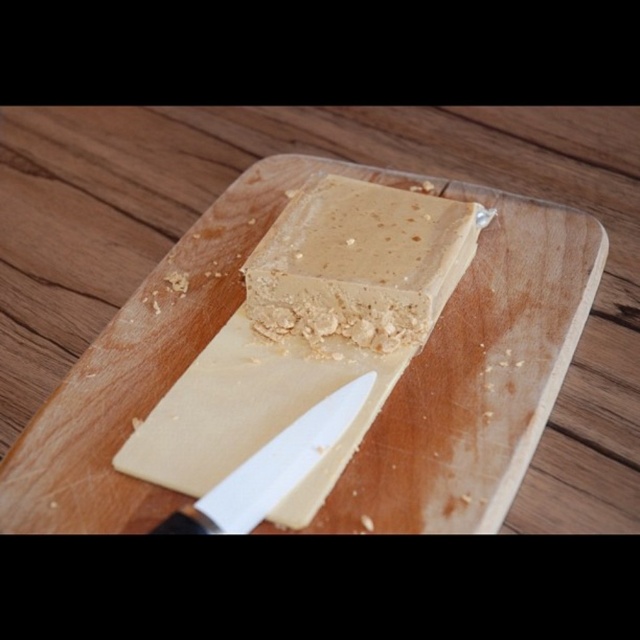
Does wooden cutting board at center have a lesser height compared to white plastic knife at center?

In fact, wooden cutting board at center may be taller than white plastic knife at center.

Consider the image. Which of these two, wooden cutting board at center or white plastic knife at center, stands shorter?

white plastic knife at center is shorter.

Is point (524, 307) closer to viewer compared to point (304, 448)?

No.

I want to click on wooden cutting board at center, so click(385, 404).

Measure the distance between golden crumbly dough at center and white plastic knife at center.

A distance of 8.47 inches exists between golden crumbly dough at center and white plastic knife at center.

Is point (401, 253) positioned before point (218, 492)?

No.

Is point (433, 280) in front of point (323, 417)?

That is False.

Where is `golden crumbly dough at center`? The image size is (640, 640). golden crumbly dough at center is located at coordinates (355, 264).

Is wooden cutting board at center below golden crumbly dough at center?

Correct, wooden cutting board at center is located below golden crumbly dough at center.

Between wooden cutting board at center and golden crumbly dough at center, which one has less height?

With less height is golden crumbly dough at center.

I want to click on wooden cutting board at center, so click(385, 404).